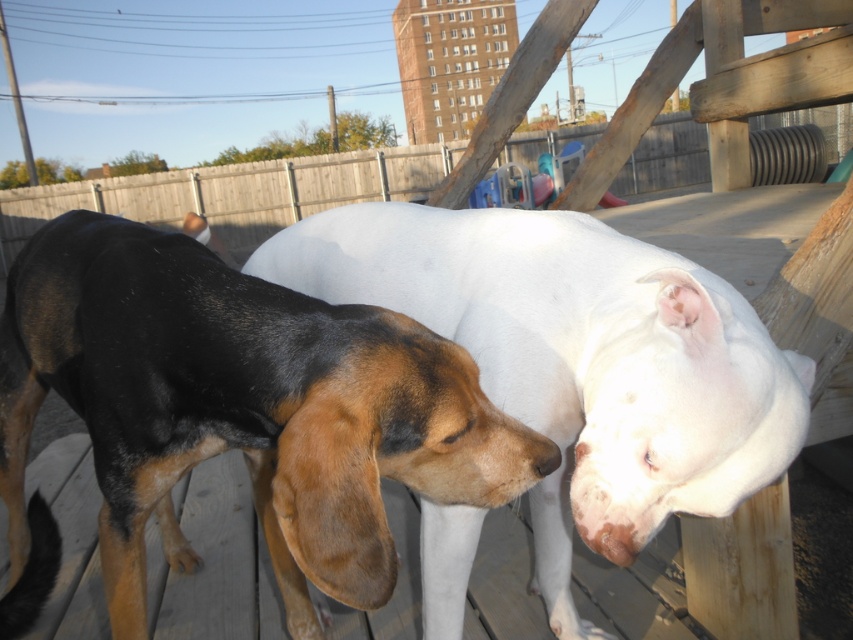
Does brown and black fur dog at center have a smaller size compared to white smooth dog at center?

No.

This screenshot has width=853, height=640. I want to click on brown and black fur dog at center, so click(x=233, y=413).

This screenshot has width=853, height=640. Find the location of `brown and black fur dog at center`. brown and black fur dog at center is located at coordinates (233, 413).